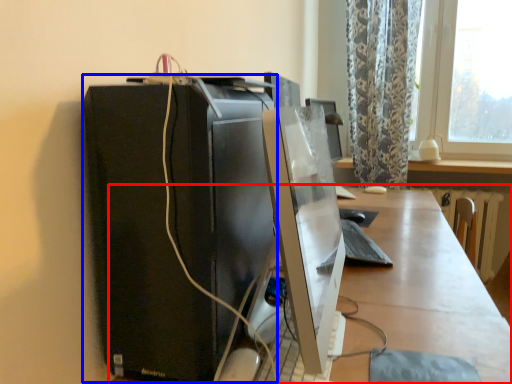
Question: Which point is closer to the camera, desk (highlighted by a red box) or computer tower (highlighted by a blue box)?

Choices:
 (A) desk
 (B) computer tower

Answer: (A)